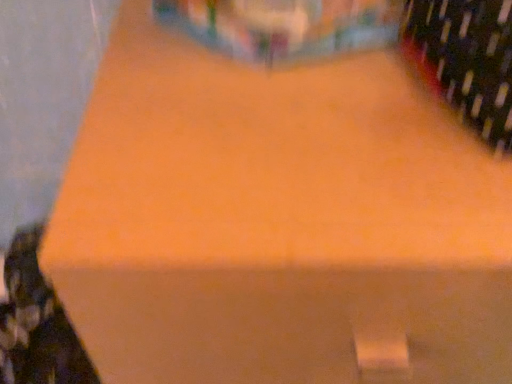
Question: Is matte black wine bottle at lower left, acting as the 2th wine bottle starting from the right, positioned far away from dark green glass wine bottle at upper right, acting as the first wine bottle starting from the right?

Choices:
 (A) no
 (B) yes

Answer: (A)

Question: Can you confirm if matte black wine bottle at lower left, the 1th wine bottle from the left, is shorter than dark green glass wine bottle at upper right, the 2th wine bottle ordered from the bottom?

Choices:
 (A) no
 (B) yes

Answer: (A)

Question: From the image's perspective, would you say matte black wine bottle at lower left, which is counted as the 1th wine bottle, starting from the back, is positioned over dark green glass wine bottle at upper right, the 1th wine bottle from the top?

Choices:
 (A) no
 (B) yes

Answer: (A)

Question: Does matte black wine bottle at lower left, the first wine bottle positioned from the bottom, appear on the left side of dark green glass wine bottle at upper right, the 2th wine bottle ordered from the bottom?

Choices:
 (A) no
 (B) yes

Answer: (B)

Question: Is the surface of matte black wine bottle at lower left, marked as the 2th wine bottle in a top-to-bottom arrangement, in direct contact with dark green glass wine bottle at upper right, the 2th wine bottle ordered from the bottom?

Choices:
 (A) no
 (B) yes

Answer: (A)

Question: From a real-world perspective, is matte black wine bottle at lower left, which appears as the 2th wine bottle when viewed from the front, under dark green glass wine bottle at upper right, which appears as the second wine bottle when viewed from the left?

Choices:
 (A) no
 (B) yes

Answer: (B)

Question: Is dark green glass wine bottle at upper right, acting as the first wine bottle starting from the right, positioned with its back to matte black wine bottle at lower left, marked as the 2th wine bottle in a top-to-bottom arrangement?

Choices:
 (A) no
 (B) yes

Answer: (A)

Question: Is dark green glass wine bottle at upper right, the 2th wine bottle ordered from the bottom, to the right of matte black wine bottle at lower left, which is counted as the 1th wine bottle, starting from the back, from the viewer's perspective?

Choices:
 (A) yes
 (B) no

Answer: (A)

Question: Can you confirm if dark green glass wine bottle at upper right, the 1th wine bottle from the top, is shorter than matte black wine bottle at lower left, acting as the 2th wine bottle starting from the right?

Choices:
 (A) no
 (B) yes

Answer: (B)

Question: From a real-world perspective, is dark green glass wine bottle at upper right, acting as the first wine bottle starting from the right, under matte black wine bottle at lower left, the first wine bottle positioned from the bottom?

Choices:
 (A) no
 (B) yes

Answer: (A)

Question: Is dark green glass wine bottle at upper right, acting as the first wine bottle starting from the right, far from matte black wine bottle at lower left, acting as the 2th wine bottle starting from the right?

Choices:
 (A) no
 (B) yes

Answer: (A)

Question: Does dark green glass wine bottle at upper right, which appears as the second wine bottle when viewed from the left, appear on the left side of matte black wine bottle at lower left, which appears as the 2th wine bottle when viewed from the front?

Choices:
 (A) yes
 (B) no

Answer: (B)

Question: Would you say matte black wine bottle at lower left, the first wine bottle positioned from the bottom, is to the left or to the right of dark green glass wine bottle at upper right, which appears as the second wine bottle when viewed from the left, in the picture?

Choices:
 (A) right
 (B) left

Answer: (B)